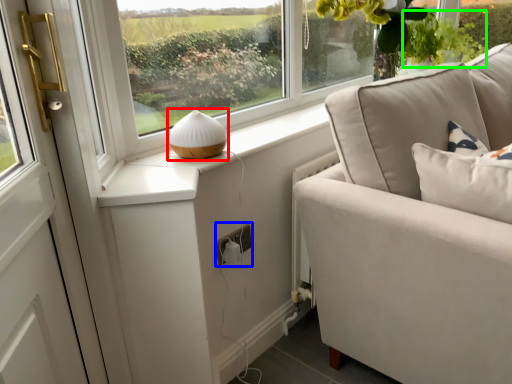
Question: Which object is positioned farthest from table lamp (highlighted by a red box)? Select from electric outlet (highlighted by a blue box) and plant (highlighted by a green box).

Choices:
 (A) electric outlet
 (B) plant

Answer: (B)